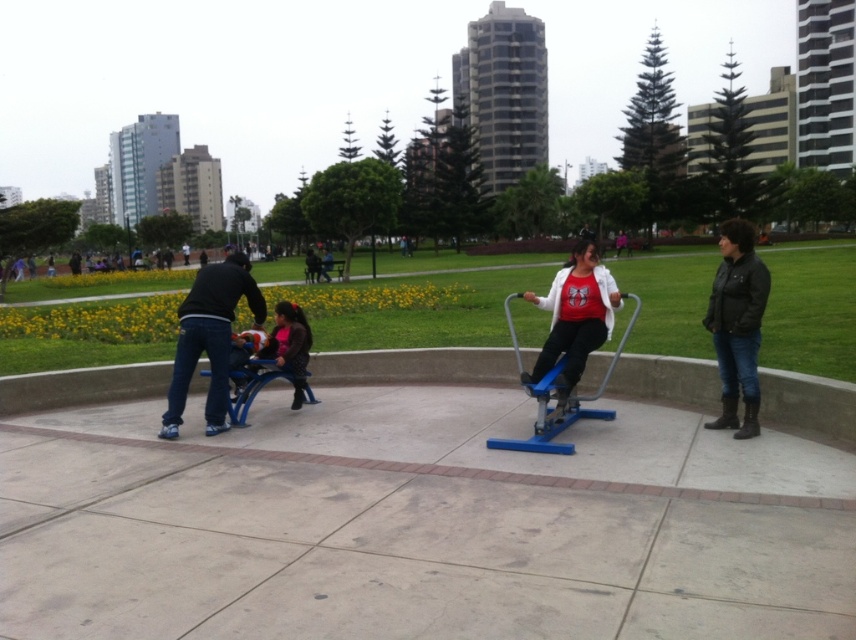
Question: Which of these objects is positioned closest to the matte white shirt at center?

Choices:
 (A) black leather jacket at lower right
 (B) concrete at center

Answer: (A)

Question: Can you confirm if concrete at center is smaller than blue plastic exercise machine at center?

Choices:
 (A) no
 (B) yes

Answer: (B)

Question: Which object is positioned farthest from the blue plastic exercise machine at center?

Choices:
 (A) matte white shirt at center
 (B) black leather jacket at lower right
 (C) dark brown leather jacket at center

Answer: (C)

Question: Does concrete at center have a greater width compared to dark brown leather jacket at center?

Choices:
 (A) yes
 (B) no

Answer: (A)

Question: Is dark blue jeans at left smaller than blue plastic exercise machine at center?

Choices:
 (A) yes
 (B) no

Answer: (A)

Question: Which point is closer to the camera?

Choices:
 (A) black leather jacket at lower right
 (B) concrete at center
 (C) dark blue jeans at left

Answer: (B)